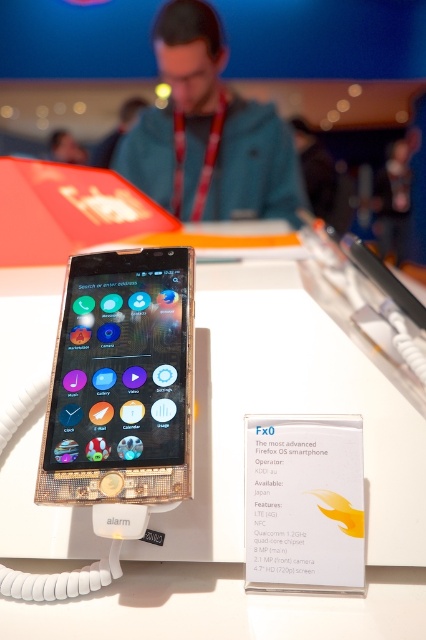
Between gold textured phone at center and matte blue jacket at upper center, which one appears on the right side from the viewer's perspective?

matte blue jacket at upper center

Is point (123, 304) farther from viewer compared to point (183, 161)?

No, (123, 304) is in front of (183, 161).

Identify the location of gold textured phone at center. Image resolution: width=426 pixels, height=640 pixels. (121, 380).

Which is above, white glossy table at center or matte blue jacket at upper center?

matte blue jacket at upper center is higher up.

Does white glossy table at center have a lesser height compared to matte blue jacket at upper center?

No, white glossy table at center is not shorter than matte blue jacket at upper center.

Which is behind, point (218, 429) or point (189, 152)?

Positioned behind is point (189, 152).

Locate an element on the screen. Image resolution: width=426 pixels, height=640 pixels. white glossy table at center is located at coordinates (242, 477).

Is point (417, 547) in front of point (92, 493)?

No, it is behind (92, 493).

Who is lower down, white glossy table at center or gold textured phone at center?

white glossy table at center

The image size is (426, 640). I want to click on white glossy table at center, so click(242, 477).